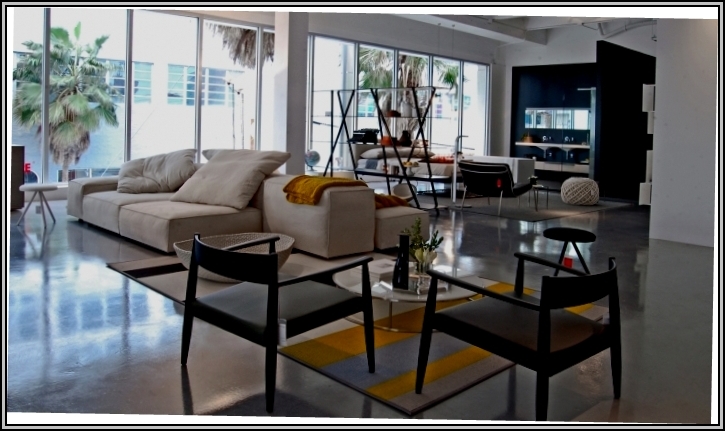
In order to click on chairs in this screenshot , I will do `click(275, 311)`, `click(526, 330)`, `click(486, 183)`.